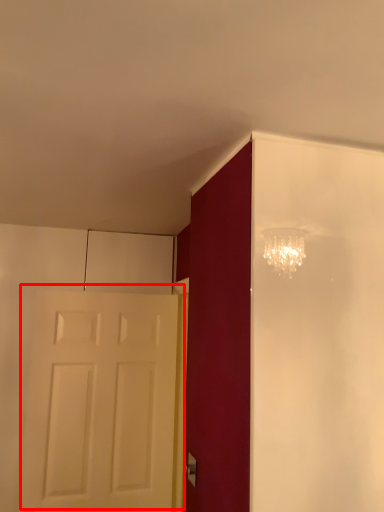
Question: From the image's perspective, what is the correct spatial relationship of door (annotated by the red box) in relation to door handle?

Choices:
 (A) below
 (B) above

Answer: (B)